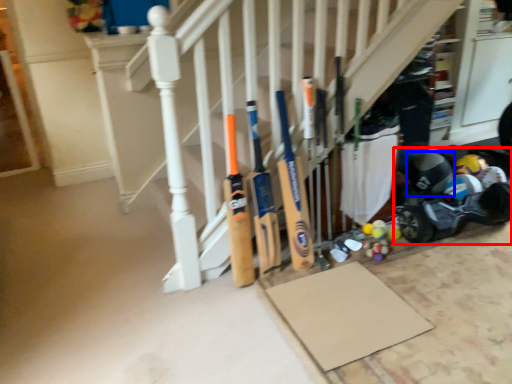
Question: Which object appears closest to the camera in this image, baby carriage (highlighted by a red box) or helmet (highlighted by a blue box)?

Choices:
 (A) baby carriage
 (B) helmet

Answer: (A)